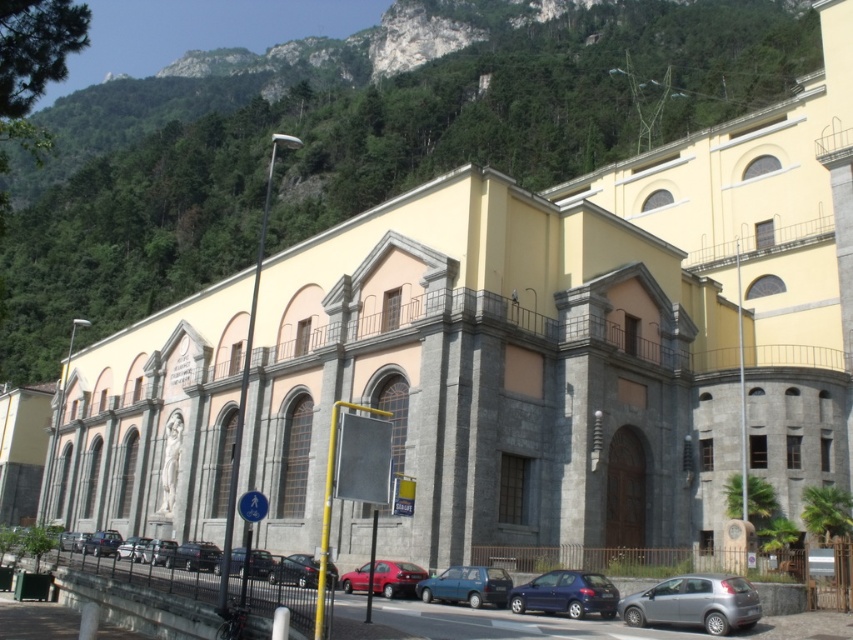
Can you confirm if metallic blue sedan at center is positioned above metallic blue hatchback at center?

No, metallic blue sedan at center is not above metallic blue hatchback at center.

Measure the distance between metallic blue sedan at center and metallic blue hatchback at center.

They are 15.25 meters apart.

This screenshot has height=640, width=853. Find the location of `metallic blue sedan at center`. metallic blue sedan at center is located at coordinates (148, 573).

I want to click on metallic blue sedan at center, so click(x=148, y=573).

Is point (674, 612) closer to camera compared to point (178, 547)?

Yes, it is in front of point (178, 547).

Does silver metallic hatchback at lower right have a larger size compared to shiny black sedan at lower left?

No.

Is point (657, 595) farther from viewer compared to point (175, 563)?

No, (657, 595) is in front of (175, 563).

Find the location of `silver metallic hatchback at lower right`. silver metallic hatchback at lower right is located at coordinates [694, 604].

Can you confirm if shiny black sedan at lower left is wider than metallic silver car at center?

In fact, shiny black sedan at lower left might be narrower than metallic silver car at center.

Does shiny black sedan at lower left have a smaller size compared to metallic silver car at center?

Yes, shiny black sedan at lower left is smaller than metallic silver car at center.

Image resolution: width=853 pixels, height=640 pixels. What are the coordinates of `shiny black sedan at lower left` in the screenshot? It's located at (194, 556).

Image resolution: width=853 pixels, height=640 pixels. I want to click on shiny black sedan at lower left, so click(194, 556).